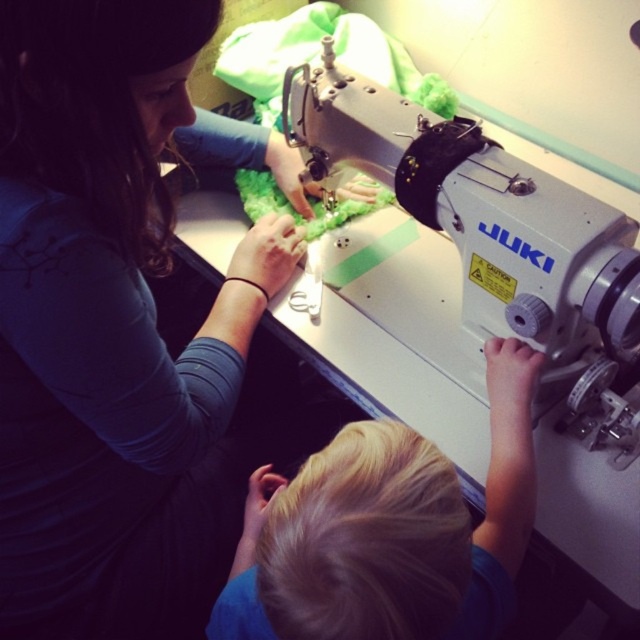
Is point (140, 426) positioned after point (508, 429)?

No, (140, 426) is closer to viewer.

In the scene shown: Does matte blue shirt at upper left have a smaller size compared to blonde hair at lower center?

No, matte blue shirt at upper left is not smaller than blonde hair at lower center.

Does point (182, 484) come in front of point (308, 515)?

No.

Where is `matte blue shirt at upper left`? The width and height of the screenshot is (640, 640). matte blue shirt at upper left is located at coordinates (113, 324).

Is silver metallic sewing machine at center taller than blonde hair at lower center?

Correct, silver metallic sewing machine at center is much taller as blonde hair at lower center.

Who is lower down, silver metallic sewing machine at center or blonde hair at lower center?

blonde hair at lower center is lower down.

Find the location of `silver metallic sewing machine at center`. silver metallic sewing machine at center is located at coordinates (488, 314).

Find the location of a particular element. This screenshot has width=640, height=640. silver metallic sewing machine at center is located at coordinates (488, 314).

Is point (3, 572) positioned after point (429, 182)?

No, it is in front of (429, 182).

What are the coordinates of `matte blue shirt at upper left` in the screenshot? It's located at (113, 324).